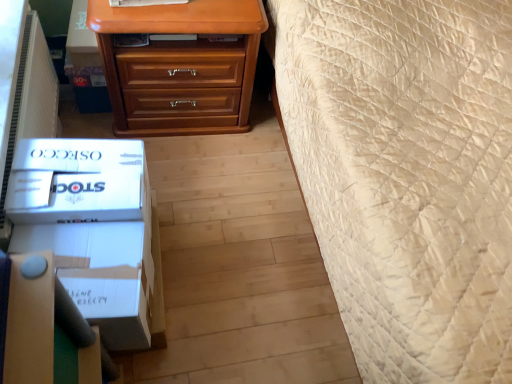
Question: In which direction should I rotate to look at matte wood chest of drawers at upper center?

Choices:
 (A) right
 (B) left

Answer: (B)

Question: From a real-world perspective, is white cardboard box at lower left, positioned as the 2th box in top-to-bottom order, physically below matte wood chest of drawers at upper center?

Choices:
 (A) yes
 (B) no

Answer: (B)

Question: Is white cardboard box at lower left, which is the 1th box in bottom-to-top order, placed right next to matte wood chest of drawers at upper center?

Choices:
 (A) yes
 (B) no

Answer: (B)

Question: Does white cardboard box at lower left, positioned as the 2th box in top-to-bottom order, have a greater height compared to matte wood chest of drawers at upper center?

Choices:
 (A) yes
 (B) no

Answer: (B)

Question: From the image's perspective, does white cardboard box at lower left, positioned as the 2th box in top-to-bottom order, appear higher than matte wood chest of drawers at upper center?

Choices:
 (A) yes
 (B) no

Answer: (B)

Question: Is white cardboard box at lower left, which is the 1th box in bottom-to-top order, completely or partially outside of matte wood chest of drawers at upper center?

Choices:
 (A) no
 (B) yes

Answer: (B)

Question: Is white cardboard box at lower left, positioned as the 2th box in top-to-bottom order, positioned in front of matte wood chest of drawers at upper center?

Choices:
 (A) no
 (B) yes

Answer: (B)

Question: Does matte wood chest of drawers at upper center have a smaller size compared to white cardboard box at lower left, positioned as the 2th box in top-to-bottom order?

Choices:
 (A) yes
 (B) no

Answer: (B)

Question: Is matte wood chest of drawers at upper center at the right side of white cardboard box at lower left, which is the 1th box in bottom-to-top order?

Choices:
 (A) no
 (B) yes

Answer: (B)

Question: Is matte wood chest of drawers at upper center outside white cardboard box at lower left, which is the 1th box in bottom-to-top order?

Choices:
 (A) yes
 (B) no

Answer: (A)

Question: Is matte wood chest of drawers at upper center facing towards white cardboard box at lower left, positioned as the 2th box in top-to-bottom order?

Choices:
 (A) yes
 (B) no

Answer: (A)

Question: From a real-world perspective, is matte wood chest of drawers at upper center on top of white cardboard box at lower left, which is the 1th box in bottom-to-top order?

Choices:
 (A) no
 (B) yes

Answer: (A)

Question: From the image's perspective, is matte wood chest of drawers at upper center above white cardboard box at lower left, which is the 1th box in bottom-to-top order?

Choices:
 (A) no
 (B) yes

Answer: (B)

Question: Is white cardboard box at lower left, which is the first box in top-to-bottom order, positioned behind matte wood chest of drawers at upper center?

Choices:
 (A) no
 (B) yes

Answer: (A)